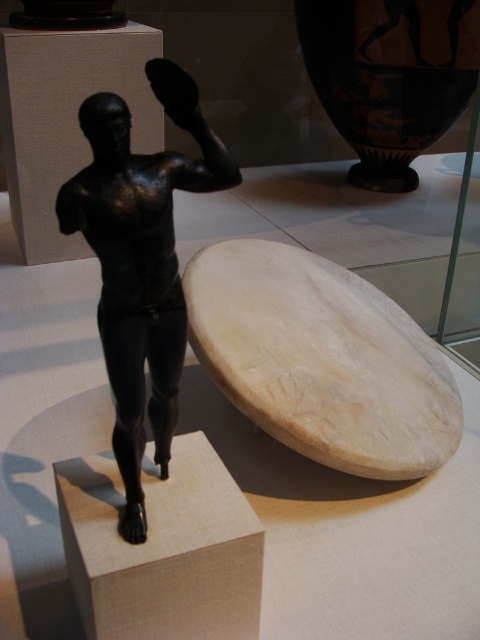
Based on the photo, you are a tour guide explaining the museum layout to visitors. Pointing to the white marble surfboard at lower center and the shiny black statue at center, you want to direct visitors to the artifact that is on the left side. Which one should you point to?

The shiny black statue at center is on the left side because the white marble surfboard at lower center is to the right of it.

Consider the image. You are a museum curator planning to move the shiny black statue at center to a different exhibit. To do this, you need to know if the white marble surfboard at lower center is directly beneath it. Can you confirm this?

Yes, the white marble surfboard at lower center is positioned under the shiny black statue at center, so it is directly beneath it.